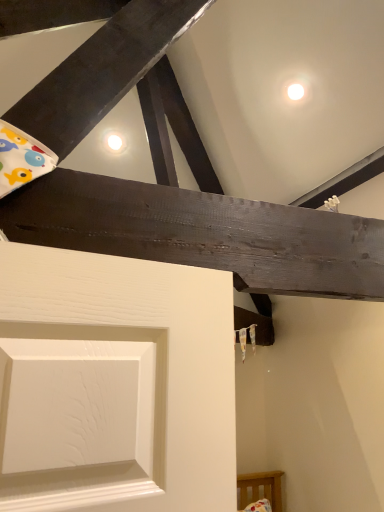
Question: Should I look upward or downward to see light brown wooden bed frame at lower right?

Choices:
 (A) down
 (B) up

Answer: (A)